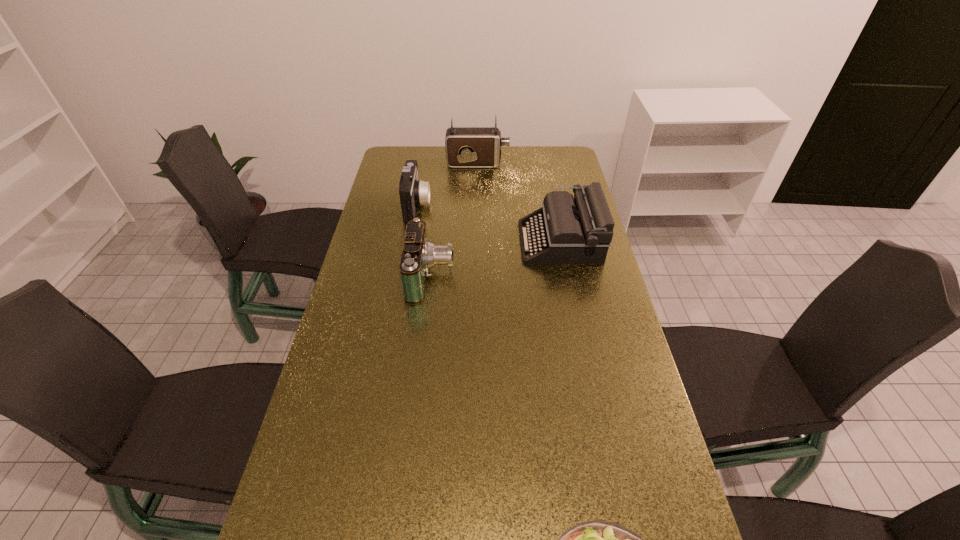
What are the coordinates of `the farthest camcorder` in the screenshot? It's located at (466, 147).

Identify the location of the farthest object. (466, 147).

Where is `typewriter`? This screenshot has height=540, width=960. typewriter is located at coordinates (565, 230).

Identify the location of the nearest camcorder. (419, 254).

The image size is (960, 540). Find the location of `the second nearest camcorder`. the second nearest camcorder is located at coordinates (412, 192).

You are a GUI agent. You are given a task and a screenshot of the screen. Output one action in this format:
    pyautogui.click(x=<x>, y=<y>)
    Task: Click on the vacant space located 0.220m at the lens of the farthest object
    The image size is (960, 540).
    Given the screenshot: What is the action you would take?
    pyautogui.click(x=560, y=163)

Identify the location of free space located 0.390m on the typing side of the typewriter. (408, 241).

Locate an element on the screen. The height and width of the screenshot is (540, 960). vacant region located on the typing side of the typewriter is located at coordinates (405, 241).

Identify the location of vacant space located 0.290m on the typing side of the typewriter. The height and width of the screenshot is (540, 960). 437,241.

Identify the location of vacant region located 0.180m on the front-facing side of the nearest camcorder. (511, 276).